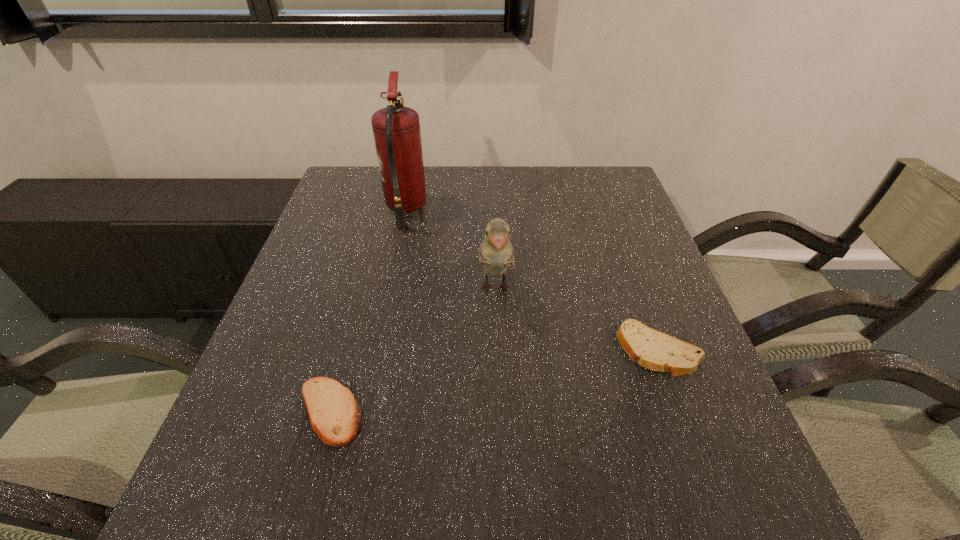
Image resolution: width=960 pixels, height=540 pixels. I want to click on empty space between the nearer pita bread and the second tallest object, so click(x=412, y=350).

The width and height of the screenshot is (960, 540). I want to click on vacant area between the left pita bread and the fire extinguisher, so click(368, 310).

Where is `object that can be found as the closest to the third farthest object`? The image size is (960, 540). object that can be found as the closest to the third farthest object is located at coordinates (496, 253).

Select which object is the third closest to the nearer pita bread. Please provide its 2D coordinates. Your answer should be formatted as a tuple, i.e. [(x, y)], where the tuple contains the x and y coordinates of a point satisfying the conditions above.

[(654, 350)]

The width and height of the screenshot is (960, 540). In order to click on vacant position in the image that satisfies the following two spatial constraints: 1. at the face of the bird; 2. on the right side of the second nearest object in this screenshot , I will do `click(497, 350)`.

You are a GUI agent. You are given a task and a screenshot of the screen. Output one action in this format:
    pyautogui.click(x=<x>, y=<y>)
    Task: Click on the free space that satisfies the following two spatial constraints: 1. at the front of the farthest object where the nozzle is aimed; 2. on the back side of the farther pita bread
    
    Given the screenshot: What is the action you would take?
    pyautogui.click(x=375, y=350)

I want to click on free location that satisfies the following two spatial constraints: 1. on the back side of the nearer pita bread; 2. on the left side of the farther pita bread, so click(347, 350).

The height and width of the screenshot is (540, 960). In order to click on vacant area that satisfies the following two spatial constraints: 1. at the front of the second nearest object where the nozzle is aimed; 2. on the right side of the farthest object in this screenshot , I will do `click(375, 350)`.